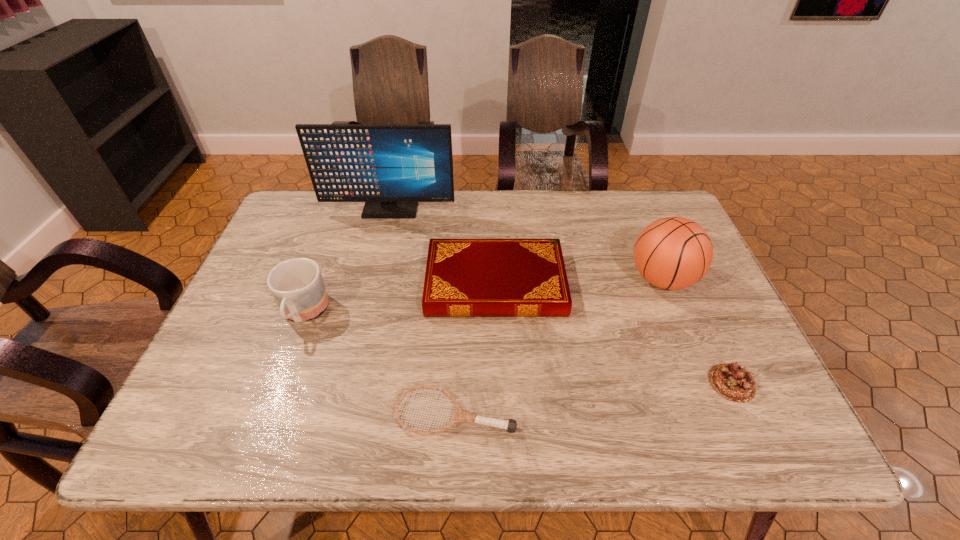
Identify the location of chocolate cake that is at the right edge. (731, 381).

In order to click on object located at the far left corner in this screenshot , I will do `click(391, 167)`.

Where is `blank space at the far edge of the desktop`? blank space at the far edge of the desktop is located at coordinates (428, 207).

The height and width of the screenshot is (540, 960). What are the coordinates of `free space at the near edge of the desktop` in the screenshot? It's located at (475, 444).

Find the location of a particular element. vacant area at the right edge of the desktop is located at coordinates tap(708, 280).

Image resolution: width=960 pixels, height=540 pixels. What are the coordinates of `vacant space at the near left corner` in the screenshot? It's located at (220, 428).

The image size is (960, 540). Find the location of `free space between the chocolate cake and the basketball`. free space between the chocolate cake and the basketball is located at coordinates pos(697,331).

At what (x,y) coordinates should I click in order to perform the action: click on free point between the fourth shortest object and the tennis racket. Please return your answer as a coordinate pair (x, y). Image resolution: width=960 pixels, height=540 pixels. Looking at the image, I should click on (379, 363).

Where is `free space that is in between the tennis racket and the hardback book`? free space that is in between the tennis racket and the hardback book is located at coordinates (475, 348).

I want to click on vacant region between the tallest object and the fourth shortest object, so click(x=347, y=262).